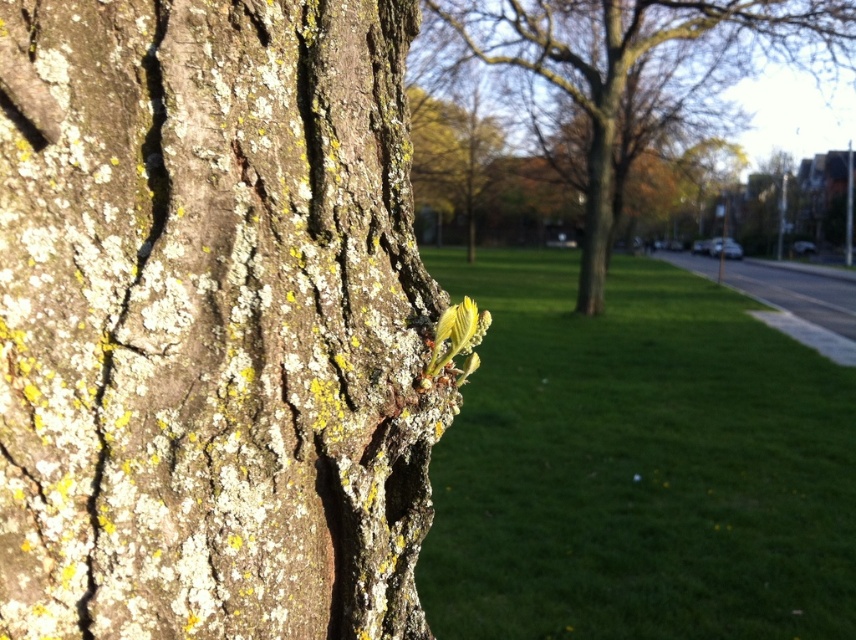
Between point (257, 316) and point (553, 499), which one is positioned in front?

Point (257, 316) is more forward.

Can you confirm if cracked bark tree trunk at center is positioned to the right of green grass at center?

In fact, cracked bark tree trunk at center is to the left of green grass at center.

Is point (266, 486) positioned behind point (847, 508)?

No, (266, 486) is in front of (847, 508).

Locate an element on the screen. The image size is (856, 640). cracked bark tree trunk at center is located at coordinates (210, 321).

Between green grass at center and smooth bark tree at center, which one appears on the right side from the viewer's perspective?

smooth bark tree at center

Between green grass at center and smooth bark tree at center, which one is positioned lower?

A: green grass at center

This screenshot has width=856, height=640. What do you see at coordinates (637, 465) in the screenshot? I see `green grass at center` at bounding box center [637, 465].

Locate an element on the screen. The height and width of the screenshot is (640, 856). green grass at center is located at coordinates (637, 465).

Is cracked bark tree trunk at center closer to the viewer compared to green lichen-covered tree trunk at center?

Yes, cracked bark tree trunk at center is closer to the viewer.

In the scene shown: Can you confirm if cracked bark tree trunk at center is positioned above green lichen-covered tree trunk at center?

No, cracked bark tree trunk at center is not above green lichen-covered tree trunk at center.

What do you see at coordinates (210, 321) in the screenshot? I see `cracked bark tree trunk at center` at bounding box center [210, 321].

At what (x,y) coordinates should I click in order to perform the action: click on cracked bark tree trunk at center. Please return your answer as a coordinate pair (x, y). This screenshot has width=856, height=640. Looking at the image, I should click on (210, 321).